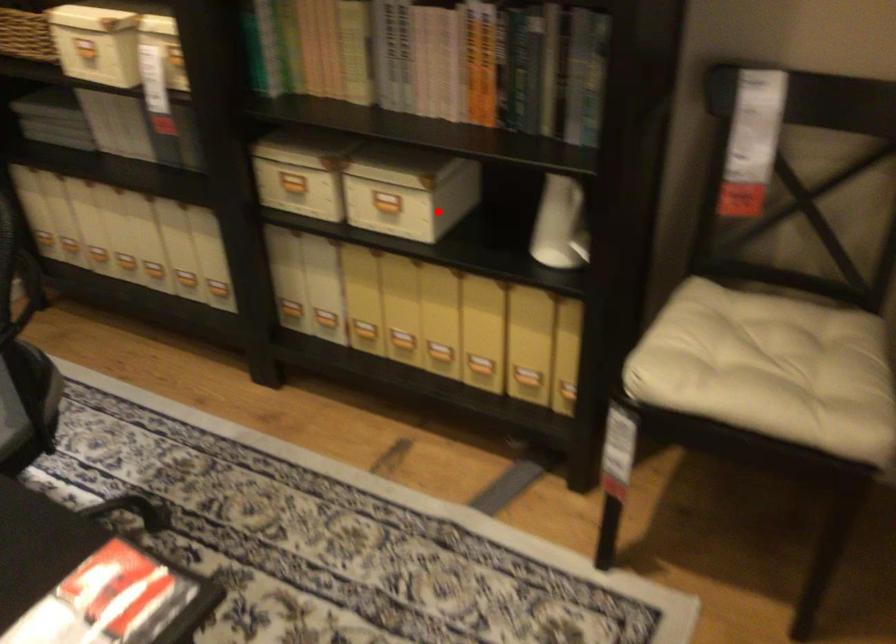
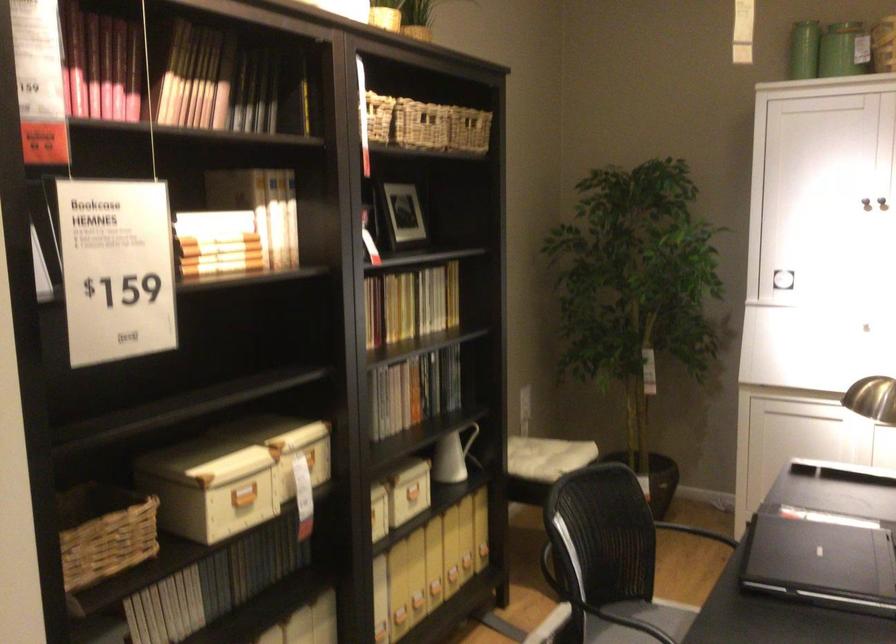
Question: I am providing you with two images of the same scene from different viewpoints. Given a red point in image1, look at the same physical point in image2. Is it:

Choices:
 (A) Closer to the viewpoint
 (B) Farther from the viewpoint

Answer: (B)